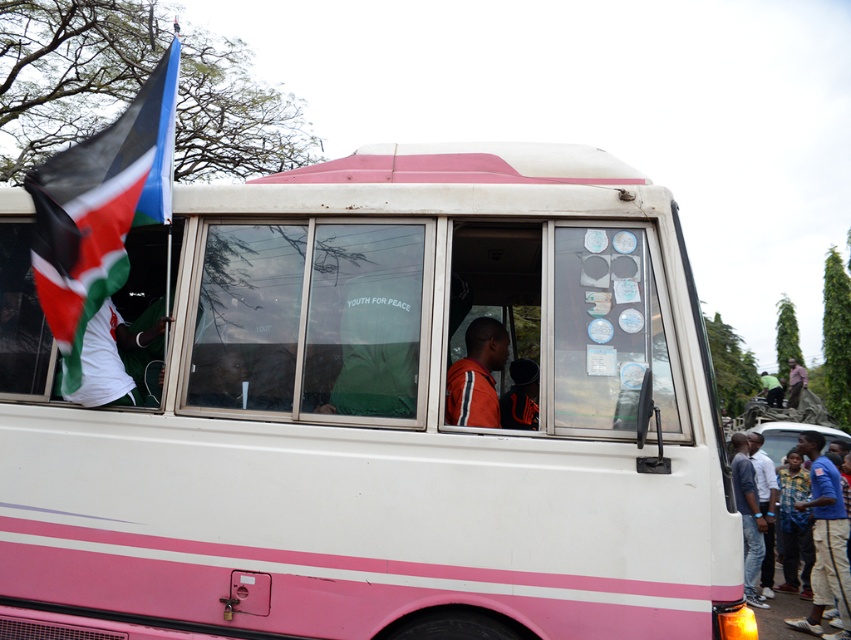
Question: Does tri-color fabric flag at left appear on the left side of dark brown leather jacket at center?

Choices:
 (A) no
 (B) yes

Answer: (B)

Question: Is blue cotton shirt at lower right wider than dark brown leather jacket at center?

Choices:
 (A) no
 (B) yes

Answer: (A)

Question: Which object appears closest to the camera in this image?

Choices:
 (A) orange jersey at center
 (B) tri-color fabric flag at left

Answer: (A)

Question: Is blue cotton shirt at lower right below blue jeans at lower right?

Choices:
 (A) yes
 (B) no

Answer: (B)

Question: Among these points, which one is nearest to the camera?

Choices:
 (A) (335, 266)
 (B) (769, 579)
 (C) (161, 122)

Answer: (A)

Question: Estimate the real-world distances between objects in this image. Which object is farther from the jeans at right?

Choices:
 (A) blue jeans at lower right
 (B) tri-color fabric flag at left
 (C) dark brown leather jacket at center
 (D) white matte tour bus at center

Answer: (C)